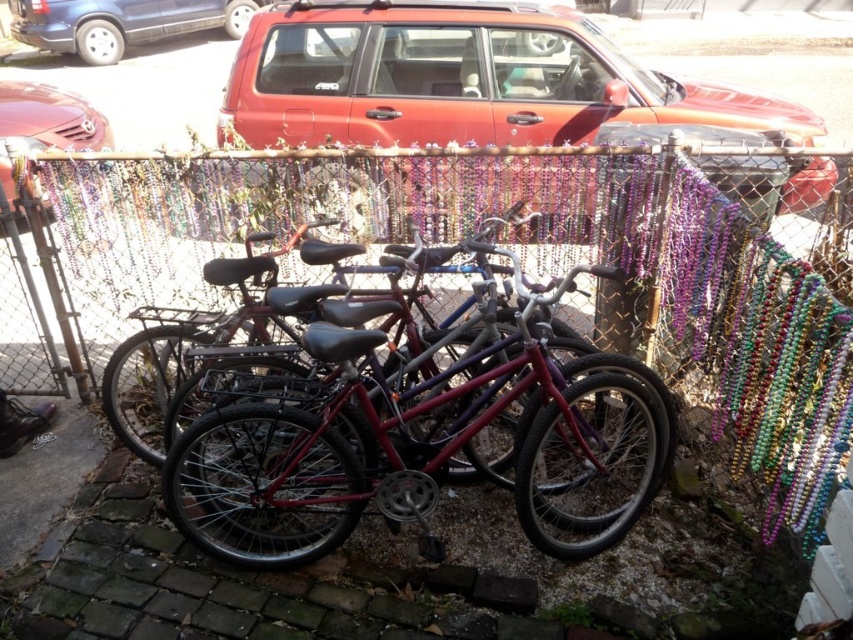
Question: Does shiny red bicycle at center have a larger size compared to blue metallic van at upper left?

Choices:
 (A) yes
 (B) no

Answer: (B)

Question: Is shiny red bicycle at center closer to camera compared to matte red suv at center?

Choices:
 (A) yes
 (B) no

Answer: (A)

Question: Which point is farther from the camera taking this photo?

Choices:
 (A) (27, 17)
 (B) (399, 56)
 (C) (305, 499)

Answer: (A)

Question: Which point is farther to the camera?

Choices:
 (A) (56, 45)
 (B) (461, 93)

Answer: (A)

Question: Among these objects, which one is farthest from the camera?

Choices:
 (A) metallic chain-link fence at center
 (B) matte red suv at center
 (C) blue metallic van at upper left

Answer: (C)

Question: Can you confirm if blue metallic van at upper left is positioned below shiny red car at left?

Choices:
 (A) no
 (B) yes

Answer: (A)